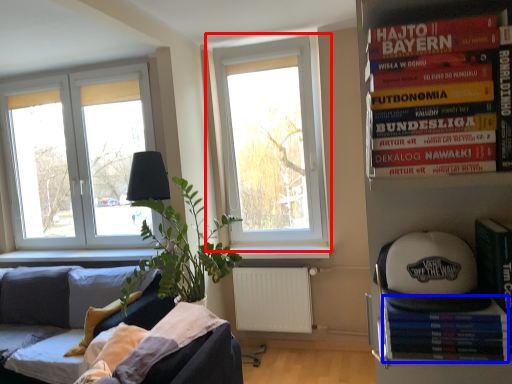
Question: Which of the following is the farthest to the observer, window (highlighted by a red box) or paperback book (highlighted by a blue box)?

Choices:
 (A) window
 (B) paperback book

Answer: (A)